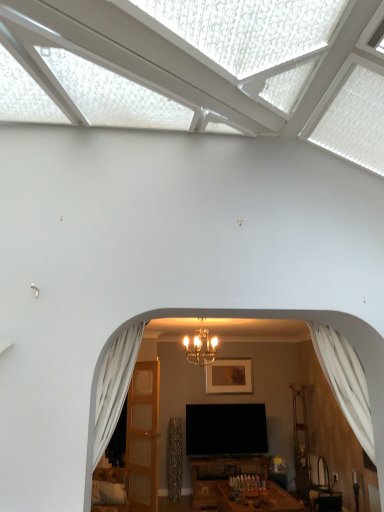
Question: Does white sheer curtain at left, arranged as the second curtain when viewed from the right, turn towards metallic chandelier at center?

Choices:
 (A) yes
 (B) no

Answer: (B)

Question: From the image's perspective, is white sheer curtain at left, positioned as the 1th curtain in left-to-right order, on metallic chandelier at center?

Choices:
 (A) no
 (B) yes

Answer: (B)

Question: Is white sheer curtain at left, positioned as the 1th curtain in left-to-right order, not near metallic chandelier at center?

Choices:
 (A) no
 (B) yes

Answer: (B)

Question: Can metallic chandelier at center be found inside white sheer curtain at left, arranged as the second curtain when viewed from the right?

Choices:
 (A) yes
 (B) no

Answer: (B)

Question: Is white sheer curtain at left, positioned as the 1th curtain in left-to-right order, outside of metallic chandelier at center?

Choices:
 (A) no
 (B) yes

Answer: (B)

Question: Is light brown wooden door at center to the left or to the right of matte gold picture frame at center in the image?

Choices:
 (A) right
 (B) left

Answer: (B)

Question: Considering their positions, is light brown wooden door at center located in front of or behind matte gold picture frame at center?

Choices:
 (A) behind
 (B) front

Answer: (B)

Question: Which is correct: light brown wooden door at center is inside matte gold picture frame at center, or outside of it?

Choices:
 (A) inside
 (B) outside

Answer: (B)

Question: Does point (135, 501) appear closer or farther from the camera than point (218, 392)?

Choices:
 (A) closer
 (B) farther

Answer: (A)

Question: Is light brown wooden door at center inside or outside of metallic chandelier at center?

Choices:
 (A) inside
 (B) outside

Answer: (B)

Question: From a real-world perspective, is light brown wooden door at center above or below metallic chandelier at center?

Choices:
 (A) above
 (B) below

Answer: (B)

Question: In the image, is light brown wooden door at center positioned in front of or behind metallic chandelier at center?

Choices:
 (A) front
 (B) behind

Answer: (B)

Question: Would you say light brown wooden door at center is to the left or to the right of metallic chandelier at center in the picture?

Choices:
 (A) left
 (B) right

Answer: (A)

Question: In terms of width, does matte gold picture frame at center look wider or thinner when compared to light brown wooden door at center?

Choices:
 (A) thin
 (B) wide

Answer: (B)

Question: Considering the relative positions of matte gold picture frame at center and light brown wooden door at center in the image provided, is matte gold picture frame at center to the left or to the right of light brown wooden door at center?

Choices:
 (A) left
 (B) right

Answer: (B)